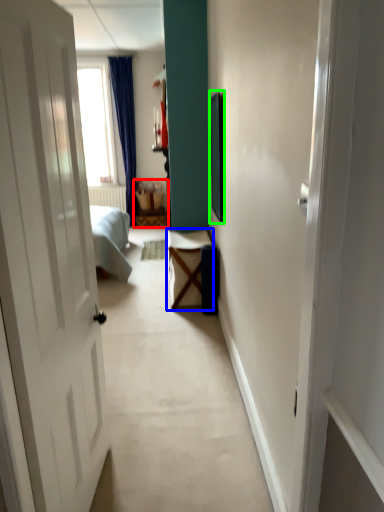
Question: Considering the real-world distances, which object is farthest from furniture (highlighted by a red box)? table (highlighted by a blue box) or picture frame (highlighted by a green box)?

Choices:
 (A) table
 (B) picture frame

Answer: (A)